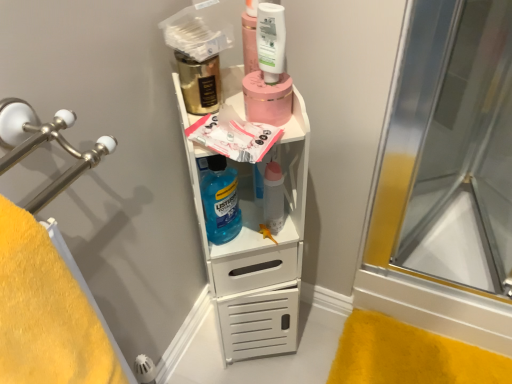
Question: Is white matte cabinet at center surrounded by gold metallic mouthwash at upper center, acting as the first mouthwash starting from the back?

Choices:
 (A) no
 (B) yes

Answer: (A)

Question: Is gold metallic mouthwash at upper center, which is the 2th mouthwash from right to left, to the right of white matte cabinet at center from the viewer's perspective?

Choices:
 (A) no
 (B) yes

Answer: (A)

Question: Considering the relative sizes of gold metallic mouthwash at upper center, which ranks as the first mouthwash in left-to-right order, and white matte cabinet at center in the image provided, is gold metallic mouthwash at upper center, which ranks as the first mouthwash in left-to-right order, thinner than white matte cabinet at center?

Choices:
 (A) no
 (B) yes

Answer: (B)

Question: Is gold metallic mouthwash at upper center, which ranks as the first mouthwash in left-to-right order, shorter than white matte cabinet at center?

Choices:
 (A) yes
 (B) no

Answer: (A)

Question: From the image's perspective, is gold metallic mouthwash at upper center, which is the 2th mouthwash from right to left, located above white matte cabinet at center?

Choices:
 (A) yes
 (B) no

Answer: (A)

Question: Does point (280, 170) appear closer or farther from the camera than point (273, 354)?

Choices:
 (A) closer
 (B) farther

Answer: (A)

Question: From a real-world perspective, relative to white matte cabinet at center, is translucent plastic bottle at center vertically above or below?

Choices:
 (A) below
 (B) above

Answer: (B)

Question: Is translucent plastic bottle at center wider or thinner than white matte cabinet at center?

Choices:
 (A) wide
 (B) thin

Answer: (B)

Question: Is translucent plastic bottle at center inside the boundaries of white matte cabinet at center, or outside?

Choices:
 (A) outside
 (B) inside

Answer: (B)

Question: Based on their positions, is gold metallic mouthwash at upper center, which ranks as the first mouthwash in left-to-right order, located to the left or right of blue translucent mouthwash at center?

Choices:
 (A) right
 (B) left

Answer: (B)

Question: Is gold metallic mouthwash at upper center, the second mouthwash in the front-to-back sequence, situated inside blue translucent mouthwash at center or outside?

Choices:
 (A) outside
 (B) inside

Answer: (A)

Question: Is gold metallic mouthwash at upper center, the second mouthwash in the front-to-back sequence, in front of or behind blue translucent mouthwash at center in the image?

Choices:
 (A) front
 (B) behind

Answer: (A)

Question: From a real-world perspective, is gold metallic mouthwash at upper center, which is the 2th mouthwash from right to left, physically located above or below blue translucent mouthwash at center?

Choices:
 (A) above
 (B) below

Answer: (A)

Question: Based on their sizes in the image, would you say white glossy mouthwash at upper center, which ranks as the second mouthwash in left-to-right order, is bigger or smaller than transparent glass shower door at right?

Choices:
 (A) small
 (B) big

Answer: (A)

Question: In the image, is white glossy mouthwash at upper center, arranged as the first mouthwash when viewed from the front, positioned in front of or behind transparent glass shower door at right?

Choices:
 (A) behind
 (B) front

Answer: (B)